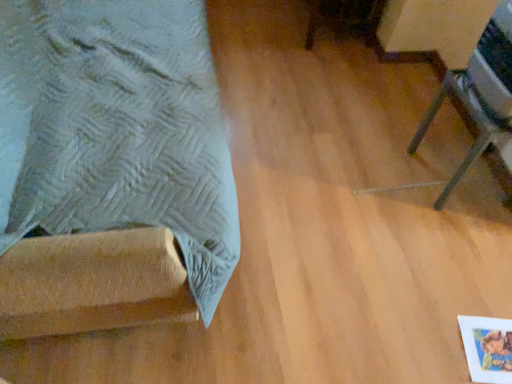
In order to click on metallic silver tripod at right, the second furniture positioned from the left in this screenshot , I will do `click(479, 93)`.

What do you see at coordinates (479, 93) in the screenshot? This screenshot has height=384, width=512. I see `metallic silver tripod at right, the first furniture from the right` at bounding box center [479, 93].

In order to face suede-like fabric at left, which ranks as the first furniture in left-to-right order, should I rotate leftwards or rightwards?

You should rotate left by 21.665 degrees.

Locate an element on the screen. This screenshot has height=384, width=512. suede-like fabric at left, positioned as the second furniture in right-to-left order is located at coordinates (111, 167).

The width and height of the screenshot is (512, 384). What do you see at coordinates (111, 167) in the screenshot? I see `suede-like fabric at left, which ranks as the first furniture in left-to-right order` at bounding box center [111, 167].

This screenshot has height=384, width=512. Find the location of `metallic silver tripod at right, the second furniture positioned from the left`. metallic silver tripod at right, the second furniture positioned from the left is located at coordinates (479, 93).

Which is more to the left, metallic silver tripod at right, the first furniture from the right, or suede-like fabric at left, which ranks as the first furniture in left-to-right order?

suede-like fabric at left, which ranks as the first furniture in left-to-right order, is more to the left.

Considering the positions of objects metallic silver tripod at right, the first furniture from the right, and suede-like fabric at left, positioned as the second furniture in right-to-left order, in the image provided, who is in front, metallic silver tripod at right, the first furniture from the right, or suede-like fabric at left, positioned as the second furniture in right-to-left order,?

suede-like fabric at left, positioned as the second furniture in right-to-left order.

Between point (511, 114) and point (76, 258), which one is positioned in front?

The point (76, 258) is closer to the camera.

From the image's perspective, does metallic silver tripod at right, the first furniture from the right, appear lower than suede-like fabric at left, positioned as the second furniture in right-to-left order?

Correct, metallic silver tripod at right, the first furniture from the right, appears lower than suede-like fabric at left, positioned as the second furniture in right-to-left order, in the image.

From a real-world perspective, is metallic silver tripod at right, the second furniture positioned from the left, physically above suede-like fabric at left, positioned as the second furniture in right-to-left order?

No, from a real-world perspective, metallic silver tripod at right, the second furniture positioned from the left, is not over suede-like fabric at left, positioned as the second furniture in right-to-left order

Is metallic silver tripod at right, the second furniture positioned from the left, wider than suede-like fabric at left, positioned as the second furniture in right-to-left order?

Incorrect, the width of metallic silver tripod at right, the second furniture positioned from the left, does not surpass that of suede-like fabric at left, positioned as the second furniture in right-to-left order.

Who is shorter, metallic silver tripod at right, the first furniture from the right, or suede-like fabric at left, which ranks as the first furniture in left-to-right order?

Standing shorter between the two is metallic silver tripod at right, the first furniture from the right.

Is metallic silver tripod at right, the first furniture from the right, smaller than suede-like fabric at left, which ranks as the first furniture in left-to-right order?

Yes.

Would you say metallic silver tripod at right, the second furniture positioned from the left, is inside or outside suede-like fabric at left, positioned as the second furniture in right-to-left order?

metallic silver tripod at right, the second furniture positioned from the left, is not inside suede-like fabric at left, positioned as the second furniture in right-to-left order, it's outside.

Would you say metallic silver tripod at right, the first furniture from the right, is a long distance from suede-like fabric at left, which ranks as the first furniture in left-to-right order?

Yes, metallic silver tripod at right, the first furniture from the right, and suede-like fabric at left, which ranks as the first furniture in left-to-right order, are located far from each other.

Is metallic silver tripod at right, the second furniture positioned from the left, oriented away from suede-like fabric at left, positioned as the second furniture in right-to-left order?

No.

Identify the location of furniture behind the suede-like fabric at left, positioned as the second furniture in right-to-left order. (479, 93).

Considering the positions of objects suede-like fabric at left, positioned as the second furniture in right-to-left order, and metallic silver tripod at right, the first furniture from the right, in the image provided, who is more to the right, suede-like fabric at left, positioned as the second furniture in right-to-left order, or metallic silver tripod at right, the first furniture from the right,?

metallic silver tripod at right, the first furniture from the right.

Considering their positions, is suede-like fabric at left, which ranks as the first furniture in left-to-right order, located in front of or behind metallic silver tripod at right, the first furniture from the right?

Clearly, suede-like fabric at left, which ranks as the first furniture in left-to-right order, is in front of metallic silver tripod at right, the first furniture from the right.

Considering the positions of point (162, 182) and point (501, 64), is point (162, 182) closer or farther from the camera than point (501, 64)?

Point (162, 182) appears to be closer to the viewer than point (501, 64).

Looking at this image, from the image's perspective, which one is positioned lower, suede-like fabric at left, which ranks as the first furniture in left-to-right order, or metallic silver tripod at right, the second furniture positioned from the left?

metallic silver tripod at right, the second furniture positioned from the left, from the image's perspective.

From a real-world perspective, which is physically below, suede-like fabric at left, positioned as the second furniture in right-to-left order, or metallic silver tripod at right, the second furniture positioned from the left?

metallic silver tripod at right, the second furniture positioned from the left.

Which of these two, suede-like fabric at left, which ranks as the first furniture in left-to-right order, or metallic silver tripod at right, the first furniture from the right, is thinner?

metallic silver tripod at right, the first furniture from the right.

Is suede-like fabric at left, which ranks as the first furniture in left-to-right order, shorter than metallic silver tripod at right, the first furniture from the right?

In fact, suede-like fabric at left, which ranks as the first furniture in left-to-right order, may be taller than metallic silver tripod at right, the first furniture from the right.

Consider the image. Considering the relative sizes of suede-like fabric at left, which ranks as the first furniture in left-to-right order, and metallic silver tripod at right, the first furniture from the right, in the image provided, is suede-like fabric at left, which ranks as the first furniture in left-to-right order, smaller than metallic silver tripod at right, the first furniture from the right,?

No, suede-like fabric at left, which ranks as the first furniture in left-to-right order, is not smaller than metallic silver tripod at right, the first furniture from the right.

Is metallic silver tripod at right, the first furniture from the right, completely or partially inside suede-like fabric at left, which ranks as the first furniture in left-to-right order?

Actually, metallic silver tripod at right, the first furniture from the right, is outside suede-like fabric at left, which ranks as the first furniture in left-to-right order.

In the scene shown: Is suede-like fabric at left, which ranks as the first furniture in left-to-right order, positioned far away from metallic silver tripod at right, the first furniture from the right?

That's right, there is a large distance between suede-like fabric at left, which ranks as the first furniture in left-to-right order, and metallic silver tripod at right, the first furniture from the right.

Does suede-like fabric at left, which ranks as the first furniture in left-to-right order, turn towards metallic silver tripod at right, the first furniture from the right?

Yes.

Identify the location of furniture below the suede-like fabric at left, positioned as the second furniture in right-to-left order (from the image's perspective). This screenshot has height=384, width=512. (479, 93).

Where is `furniture in front of the metallic silver tripod at right, the second furniture positioned from the left`? Image resolution: width=512 pixels, height=384 pixels. furniture in front of the metallic silver tripod at right, the second furniture positioned from the left is located at coordinates (111, 167).

Where is `furniture that is on the right side of suede-like fabric at left, positioned as the second furniture in right-to-left order`? furniture that is on the right side of suede-like fabric at left, positioned as the second furniture in right-to-left order is located at coordinates (479, 93).